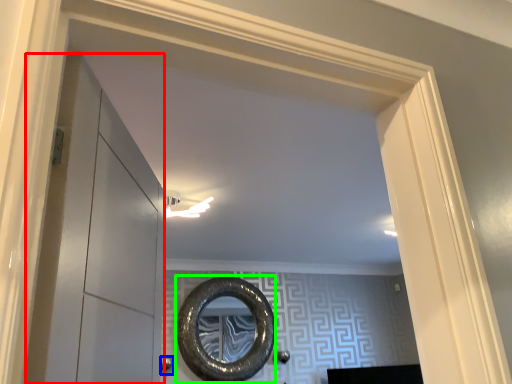
Question: Which object is positioned farthest from glass door (highlighted by a red box)? Select from door handle (highlighted by a blue box) and oval (highlighted by a green box).

Choices:
 (A) door handle
 (B) oval

Answer: (A)